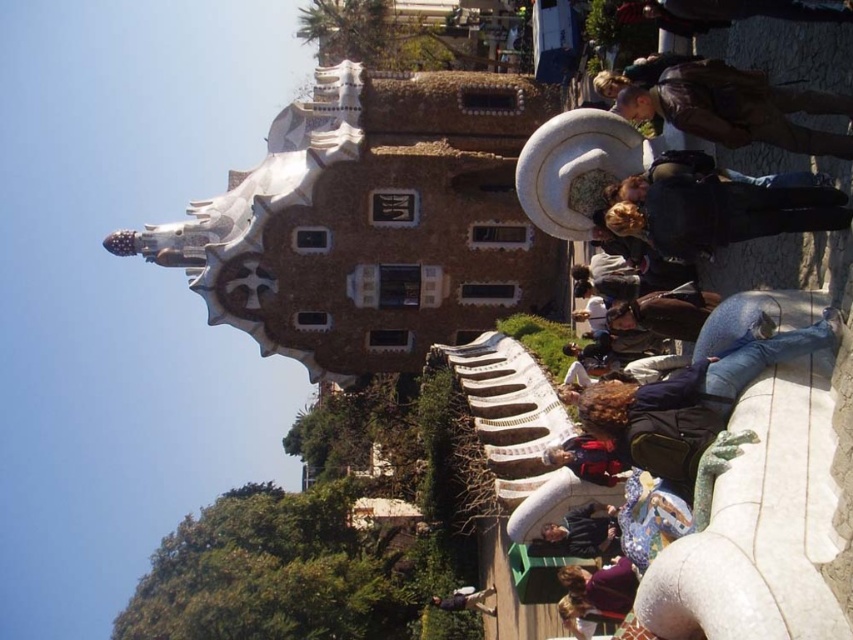
You are a tourist visiting Parc Gaud in Barcelona and you want to take a photo of the iconic Gaud architecture while also including both the blue jeans at lower right and the dark blue jacket at lower center in the frame. Which object should you position closer to the camera to ensure both are visible in the photo?

You should position the blue jeans at lower right closer to the camera since it is already closer to the viewer than the dark blue jacket at lower center, ensuring both are visible in the photo.

You are a photographer at Parc Gaud? in Barcelona and want to capture a photo of the iconic curved stone bench with the dragon motif. You notice two people sitting on the bench wearing a purple matte shirt at lower center and a dark blue jacket at lower center. If you want to include both individuals in your shot without moving them, which person should you position closer to the edge of the frame to ensure both fit?

Since the purple matte shirt at lower center occupies less space than the dark blue jacket at lower center, you should position the person in the dark blue jacket at lower center closer to the edge of the frame. This way, there will be enough space to include both individuals in the photo.

You are a photographer at Parc Gaud in Barcelona. You want to capture a photo of the iconic curved stone bench with dragon motif. You have two people in the scene wearing blue jeans at lower right and dark blue jacket at lower center. Which clothing item should you focus on to ensure it stands out more in the photo?

The blue jeans at lower right is bigger than the dark blue jacket at lower center, so focusing on the blue jeans at lower right will make it stand out more due to its larger size.